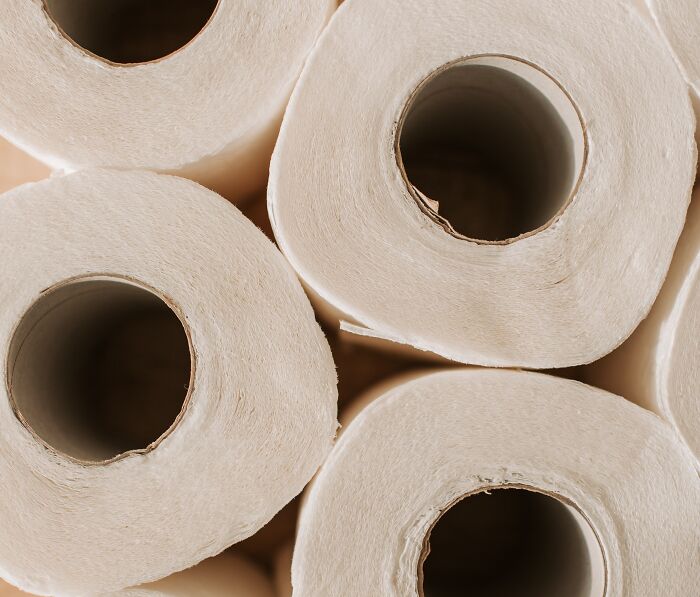
The image size is (700, 597). Identify the location of toilet paper. (588, 445), (232, 424), (619, 241), (680, 344), (676, 21), (211, 86), (190, 589).